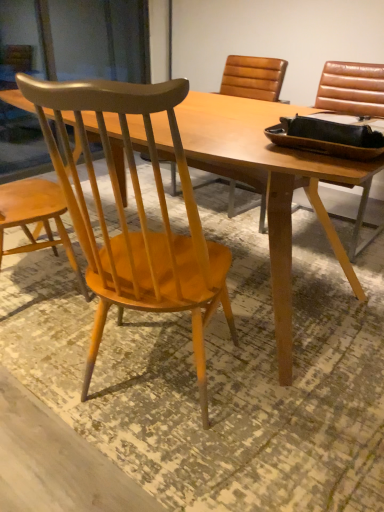
You are a GUI agent. You are given a task and a screenshot of the screen. Output one action in this format:
    pyautogui.click(x=<x>, y=<y>)
    Task: Click on the light brown wood chair at left
    The width and height of the screenshot is (384, 512).
    Given the screenshot: What is the action you would take?
    pyautogui.click(x=138, y=214)

Describe the element at coordinates (138, 214) in the screenshot. Image resolution: width=384 pixels, height=512 pixels. I see `light brown wood chair at left` at that location.

This screenshot has width=384, height=512. I want to click on light brown wood chair at left, so click(138, 214).